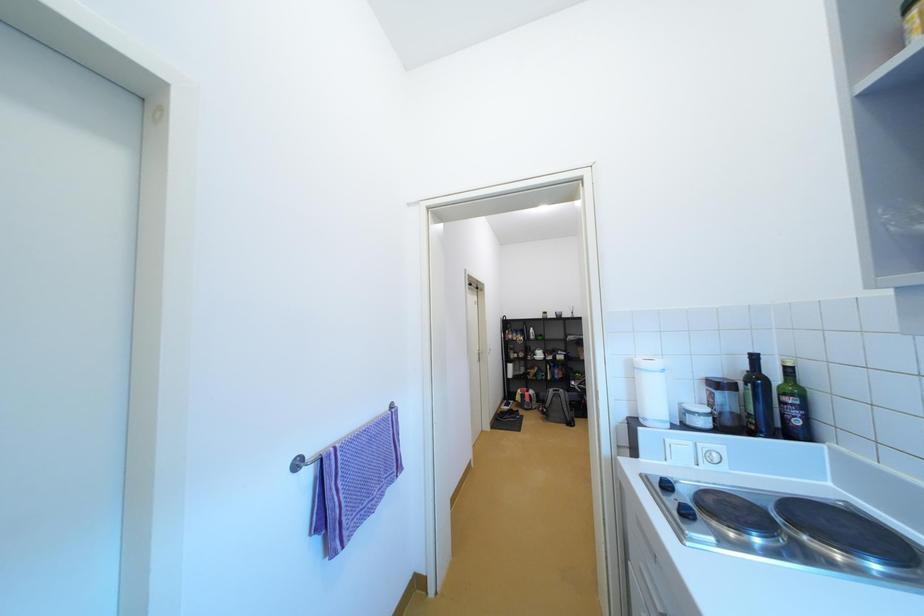
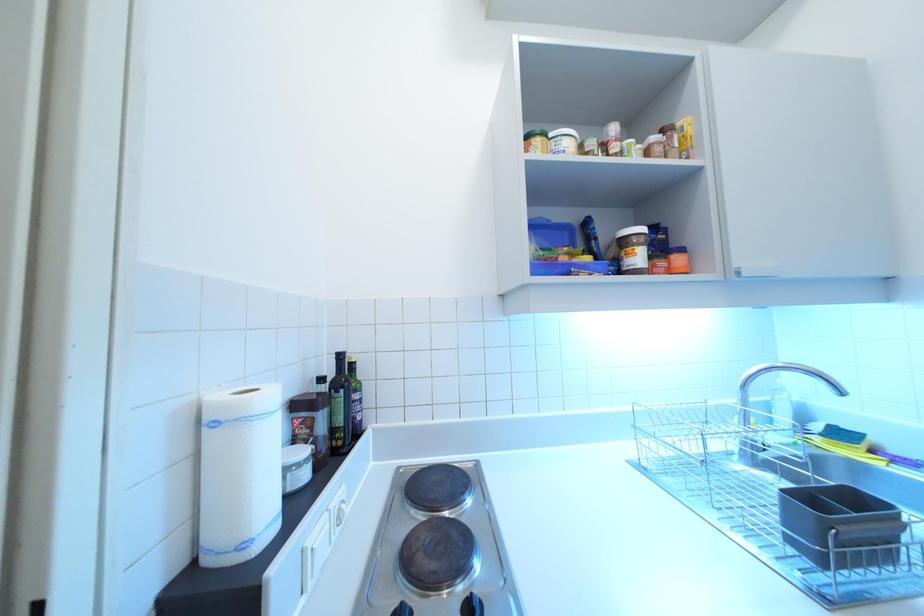
Question: The images are taken continuously from a first-person perspective. In which direction is your viewpoint rotating?

Choices:
 (A) Left
 (B) Right
 (C) Up
 (D) Down

Answer: (B)